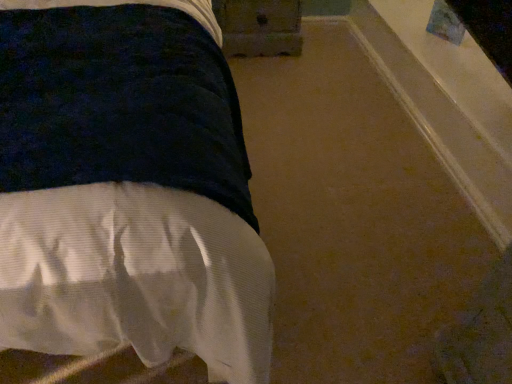
Question: Could you tell me if wooden drawer at upper center is facing white textured bed at left?

Choices:
 (A) yes
 (B) no

Answer: (A)

Question: Are wooden drawer at upper center and white textured bed at left far apart?

Choices:
 (A) yes
 (B) no

Answer: (A)

Question: Is wooden drawer at upper center closer to camera compared to white textured bed at left?

Choices:
 (A) no
 (B) yes

Answer: (A)

Question: Is white textured bed at left inside wooden drawer at upper center?

Choices:
 (A) yes
 (B) no

Answer: (B)

Question: From the image's perspective, does wooden drawer at upper center appear higher than white textured bed at left?

Choices:
 (A) no
 (B) yes

Answer: (B)

Question: Considering the relative sizes of wooden drawer at upper center and white textured bed at left in the image provided, is wooden drawer at upper center wider than white textured bed at left?

Choices:
 (A) yes
 (B) no

Answer: (B)

Question: Is white textured bed at left turned away from wooden drawer at upper center?

Choices:
 (A) no
 (B) yes

Answer: (A)

Question: Can you confirm if white textured bed at left is thinner than wooden drawer at upper center?

Choices:
 (A) yes
 (B) no

Answer: (B)

Question: From the image's perspective, would you say white textured bed at left is positioned over wooden drawer at upper center?

Choices:
 (A) no
 (B) yes

Answer: (A)

Question: Is wooden drawer at upper center inside white textured bed at left?

Choices:
 (A) no
 (B) yes

Answer: (A)

Question: Does white textured bed at left appear on the right side of wooden drawer at upper center?

Choices:
 (A) no
 (B) yes

Answer: (A)

Question: Is white textured bed at left positioned before wooden drawer at upper center?

Choices:
 (A) no
 (B) yes

Answer: (B)

Question: Is wooden drawer at upper center spatially inside white textured bed at left, or outside of it?

Choices:
 (A) outside
 (B) inside

Answer: (A)